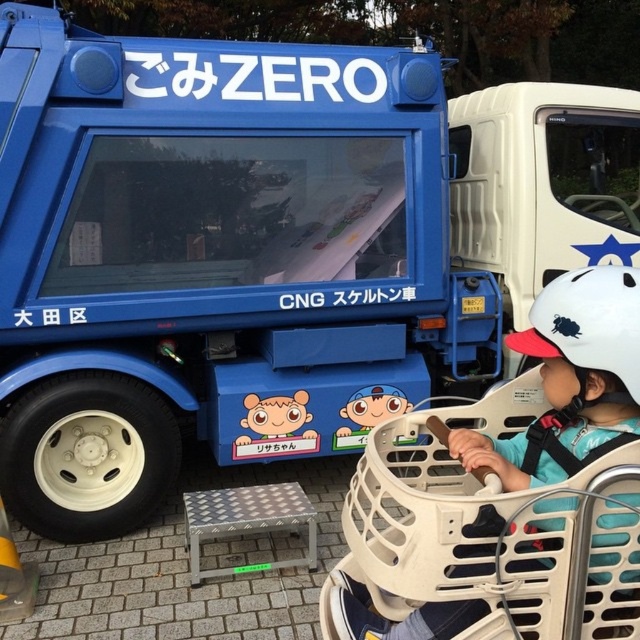
The width and height of the screenshot is (640, 640). What are the coordinates of `white matte helmet at upper right` in the screenshot? It's located at (570, 380).

Between point (506, 458) and point (616, 348), which one is positioned behind?

The point (506, 458) is behind.

Where is `white matte helmet at upper right`? This screenshot has height=640, width=640. white matte helmet at upper right is located at coordinates (570, 380).